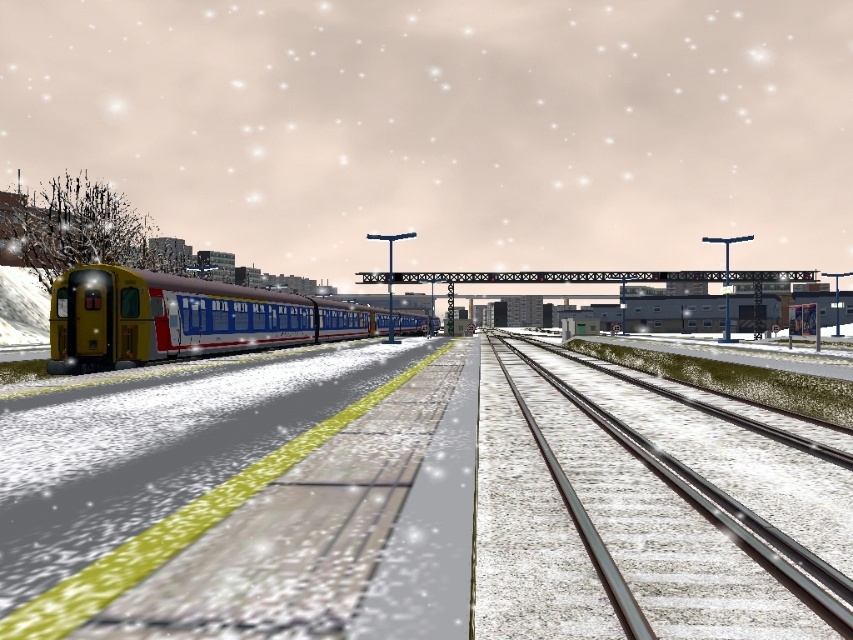
Is point (840, 620) positioned behind point (161, 282)?

That is False.

Who is positioned more to the right, metal/smooth tracks at lower right or yellow matte train at left?

metal/smooth tracks at lower right

Is point (833, 570) behind point (183, 353)?

No, (833, 570) is in front of (183, 353).

Where is `metal/smooth tracks at lower right`? The image size is (853, 640). metal/smooth tracks at lower right is located at coordinates (671, 515).